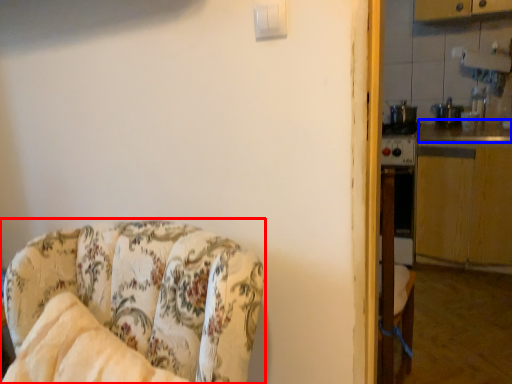
Question: Which object appears closest to the camera in this image, chair (highlighted by a red box) or counter top (highlighted by a blue box)?

Choices:
 (A) chair
 (B) counter top

Answer: (A)